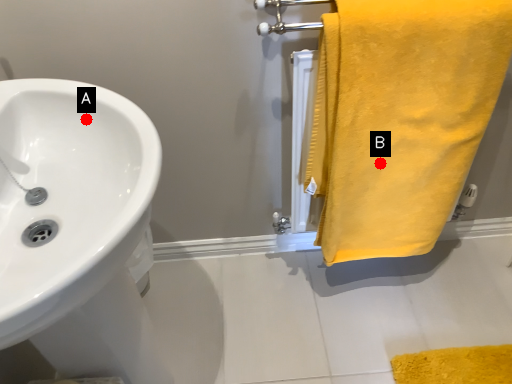
Question: Two points are circled on the image, labeled by A and B beside each circle. Which point is farther from the camera taking this photo?

Choices:
 (A) A is further
 (B) B is further

Answer: (B)